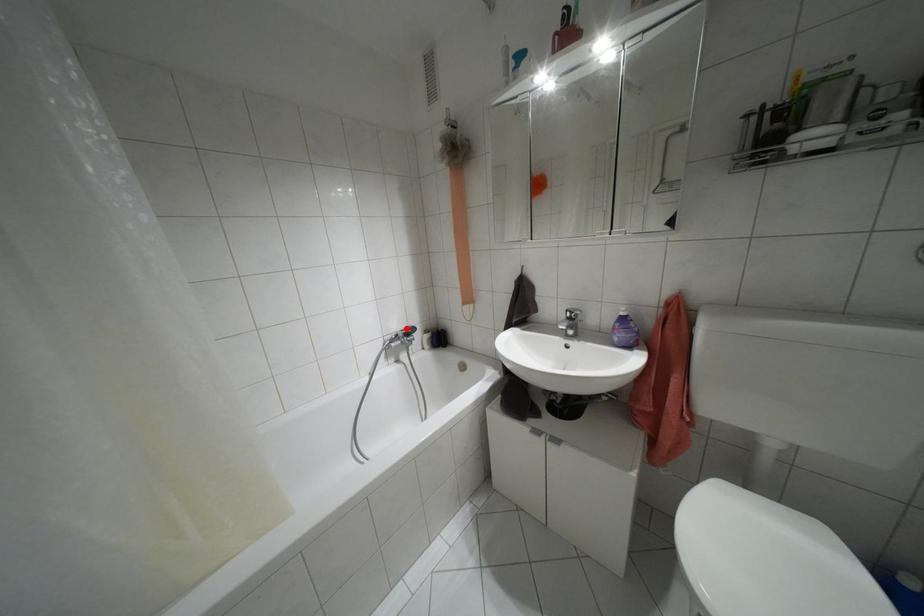
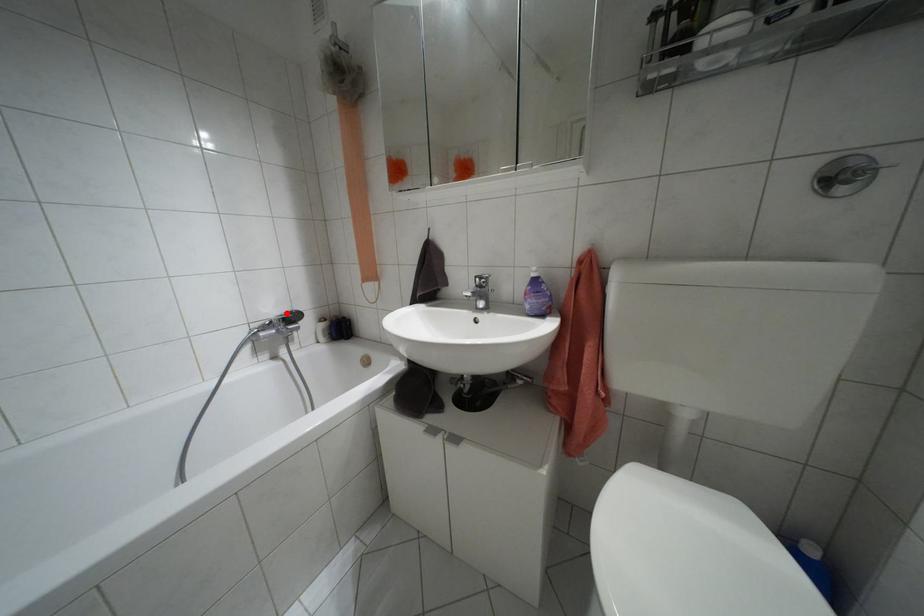
I am providing you with two images of the same scene from different viewpoints. A red point is marked on the first image and another point is marked on the second image. Are the points marked in image1 and image2 representing the same 3D position?

Yes